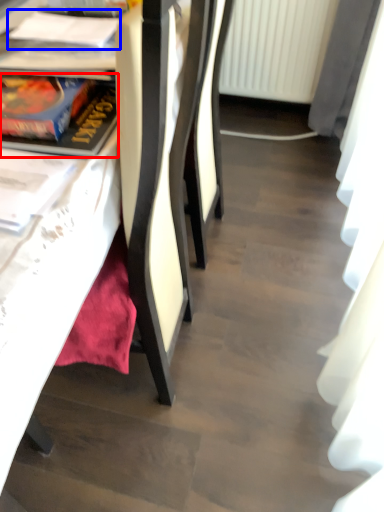
Question: Which object appears farthest to the camera in this image, book (highlighted by a red box) or book (highlighted by a blue box)?

Choices:
 (A) book
 (B) book

Answer: (B)